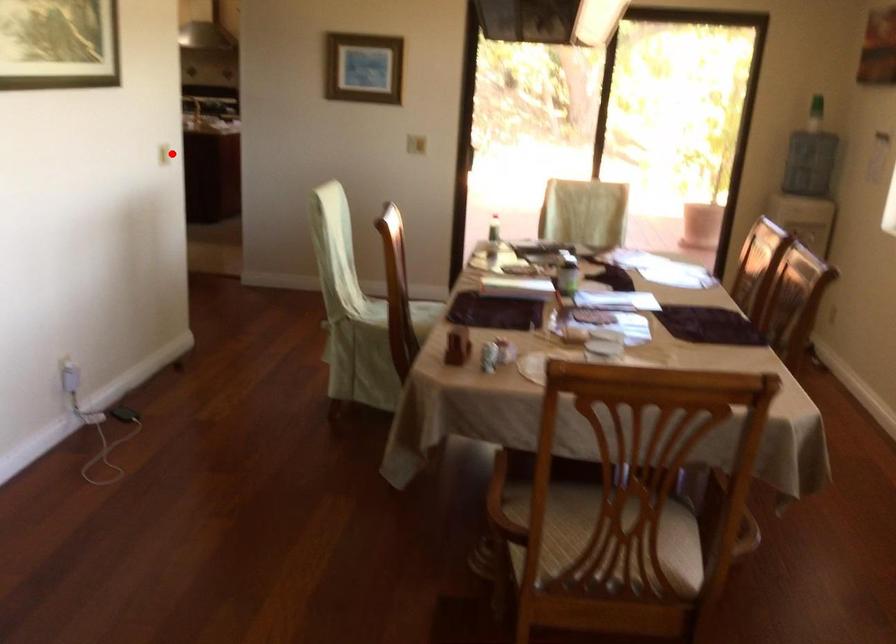
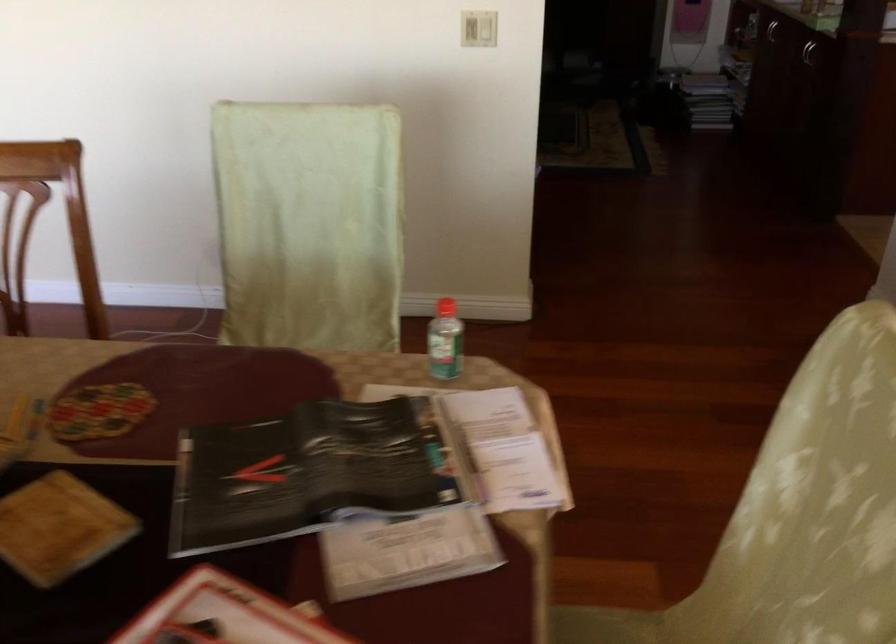
Question: I am providing you with two images of the same scene from different viewpoints. A red point is shown in image1. For the corresponding object point in image2, is it positioned nearer or farther from the camera?

Choices:
 (A) Nearer
 (B) Farther

Answer: (A)